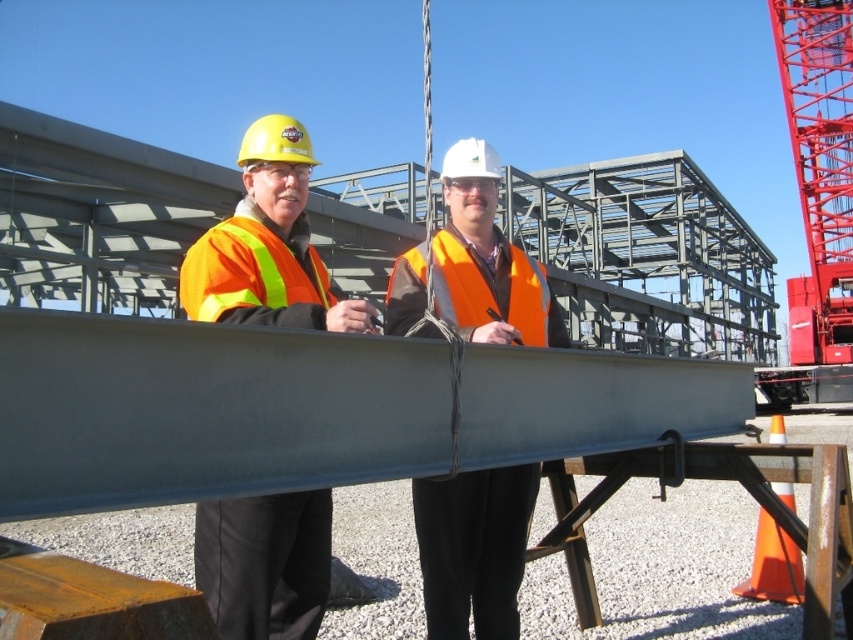
Question: Is orange reflective safety vest at left closer to camera compared to orange reflective safety vest at center?

Choices:
 (A) yes
 (B) no

Answer: (A)

Question: Among these objects, which one is nearest to the camera?

Choices:
 (A) matte orange safety vest at left
 (B) orange reflective safety vest at center

Answer: (A)

Question: Does orange reflective vest at center have a smaller size compared to orange reflective safety vest at center?

Choices:
 (A) yes
 (B) no

Answer: (B)

Question: Which object is farther from the camera taking this photo?

Choices:
 (A) orange reflective safety vest at left
 (B) matte orange safety vest at left
 (C) orange reflective vest at center

Answer: (C)

Question: Which of the following is the farthest from the observer?

Choices:
 (A) (457, 314)
 (B) (218, 524)
 (C) (393, 330)
 (D) (215, 298)

Answer: (A)

Question: Is orange reflective safety vest at left below orange reflective safety vest at center?

Choices:
 (A) no
 (B) yes

Answer: (A)